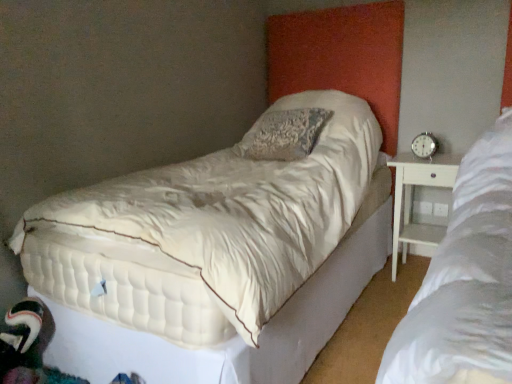
Question: Can you confirm if white quilted mattress at center is shorter than white wood nightstand at right?

Choices:
 (A) no
 (B) yes

Answer: (A)

Question: From the image's perspective, is white quilted mattress at center on white wood nightstand at right?

Choices:
 (A) yes
 (B) no

Answer: (A)

Question: Is white quilted mattress at center not near white wood nightstand at right?

Choices:
 (A) yes
 (B) no

Answer: (A)

Question: Does white quilted mattress at center have a larger size compared to white wood nightstand at right?

Choices:
 (A) no
 (B) yes

Answer: (B)

Question: Considering the relative sizes of white quilted mattress at center and white wood nightstand at right in the image provided, is white quilted mattress at center wider than white wood nightstand at right?

Choices:
 (A) yes
 (B) no

Answer: (A)

Question: In the image, is silver metallic alarm clock at right positioned in front of or behind white wood nightstand at right?

Choices:
 (A) behind
 (B) front

Answer: (A)

Question: From a real-world perspective, is silver metallic alarm clock at right positioned above or below white wood nightstand at right?

Choices:
 (A) above
 (B) below

Answer: (A)

Question: Considering the positions of silver metallic alarm clock at right and white wood nightstand at right in the image, is silver metallic alarm clock at right bigger or smaller than white wood nightstand at right?

Choices:
 (A) small
 (B) big

Answer: (A)

Question: Is point (x=428, y=147) closer or farther from the camera than point (x=452, y=158)?

Choices:
 (A) farther
 (B) closer

Answer: (A)

Question: Considering the positions of point tap(445, 175) and point tap(177, 198), is point tap(445, 175) closer or farther from the camera than point tap(177, 198)?

Choices:
 (A) farther
 (B) closer

Answer: (A)

Question: In terms of height, does white wood nightstand at right look taller or shorter compared to white quilted mattress at center?

Choices:
 (A) short
 (B) tall

Answer: (A)

Question: From the image's perspective, is white wood nightstand at right positioned above or below white quilted mattress at center?

Choices:
 (A) below
 (B) above

Answer: (A)

Question: Do you think white wood nightstand at right is within white quilted mattress at center, or outside of it?

Choices:
 (A) inside
 (B) outside

Answer: (B)

Question: Would you say white quilted mattress at center is inside or outside silver metallic alarm clock at right?

Choices:
 (A) inside
 (B) outside

Answer: (B)

Question: From their relative heights in the image, would you say white quilted mattress at center is taller or shorter than silver metallic alarm clock at right?

Choices:
 (A) short
 (B) tall

Answer: (B)